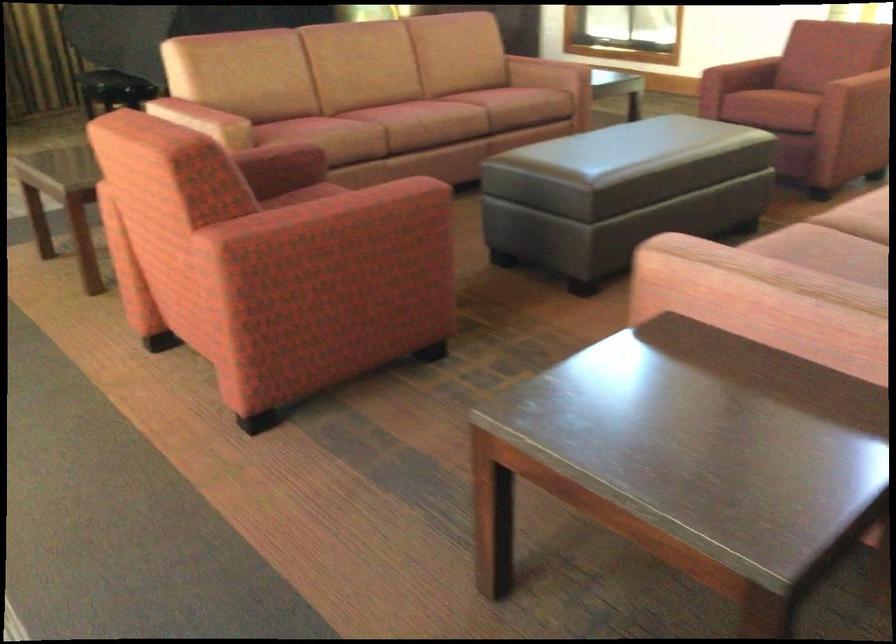
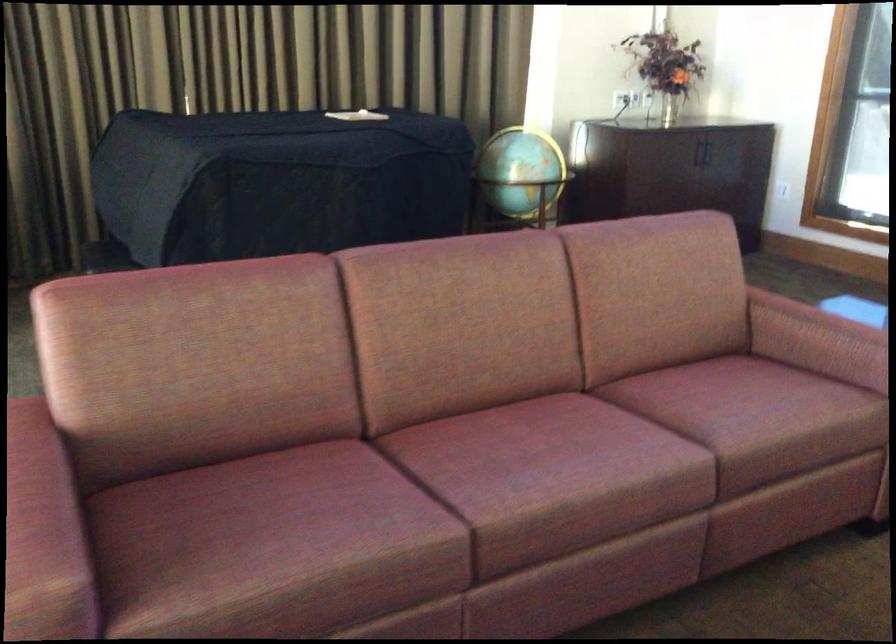
Question: The images are taken continuously from a first-person perspective. In which direction are you moving?

Choices:
 (A) Left
 (B) Right
 (C) Forward
 (D) Backward

Answer: (C)